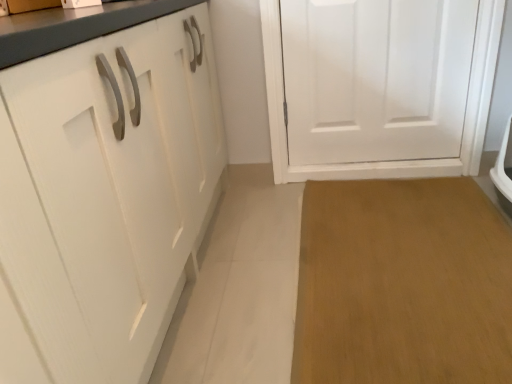
At what (x,y) coordinates should I click in order to perform the action: click on vacant area situated below brown wood floor at lower right (from a real-world perspective). Please return your answer as a coordinate pair (x, y). Looking at the image, I should click on (410, 254).